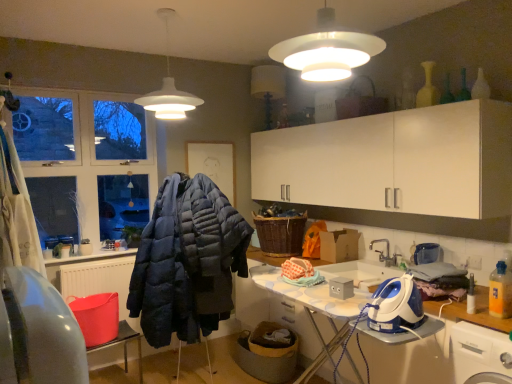
Question: Is there a large distance between blue plastic iron at lower right and dark blue quilted jacket at center?

Choices:
 (A) yes
 (B) no

Answer: (A)

Question: Considering the relative sizes of blue plastic iron at lower right and dark blue quilted jacket at center in the image provided, is blue plastic iron at lower right smaller than dark blue quilted jacket at center?

Choices:
 (A) yes
 (B) no

Answer: (A)

Question: From the image's perspective, is blue plastic iron at lower right above dark blue quilted jacket at center?

Choices:
 (A) no
 (B) yes

Answer: (B)

Question: Is blue plastic iron at lower right closer to camera compared to dark blue quilted jacket at center?

Choices:
 (A) yes
 (B) no

Answer: (A)

Question: Is blue plastic iron at lower right surrounding dark blue quilted jacket at center?

Choices:
 (A) no
 (B) yes

Answer: (A)

Question: Based on their positions, is white matte lampshade at upper center, which is counted as the 1th lamp, starting from the right, located to the left or right of white matte lampshade at upper center, arranged as the 1th lamp when viewed from the back?

Choices:
 (A) right
 (B) left

Answer: (A)

Question: Relative to white matte lampshade at upper center, arranged as the 1th lamp when viewed from the back, is white matte lampshade at upper center, the second lamp viewed from the left, in front or behind?

Choices:
 (A) front
 (B) behind

Answer: (A)

Question: Which is correct: white matte lampshade at upper center, the first lamp positioned from the front, is inside white matte lampshade at upper center, the 1th lamp when ordered from left to right, or outside of it?

Choices:
 (A) outside
 (B) inside

Answer: (A)

Question: From a real-world perspective, relative to white matte lampshade at upper center, the 1th lamp when ordered from left to right, is white matte lampshade at upper center, the second lamp viewed from the left, vertically above or below?

Choices:
 (A) below
 (B) above

Answer: (A)

Question: Visually, is woven brown basket at center positioned to the left or to the right of white plastic washing machine at lower right?

Choices:
 (A) left
 (B) right

Answer: (A)

Question: From their relative heights in the image, would you say woven brown basket at center is taller or shorter than white plastic washing machine at lower right?

Choices:
 (A) tall
 (B) short

Answer: (B)

Question: From the image's perspective, is woven brown basket at center positioned above or below white plastic washing machine at lower right?

Choices:
 (A) below
 (B) above

Answer: (B)

Question: From a real-world perspective, relative to white plastic washing machine at lower right, is woven brown basket at center vertically above or below?

Choices:
 (A) above
 (B) below

Answer: (A)

Question: Looking at their shapes, would you say blue plastic iron at lower right is wider or thinner than woven brown basket at center?

Choices:
 (A) wide
 (B) thin

Answer: (B)

Question: From the image's perspective, relative to woven brown basket at center, is blue plastic iron at lower right above or below?

Choices:
 (A) below
 (B) above

Answer: (A)